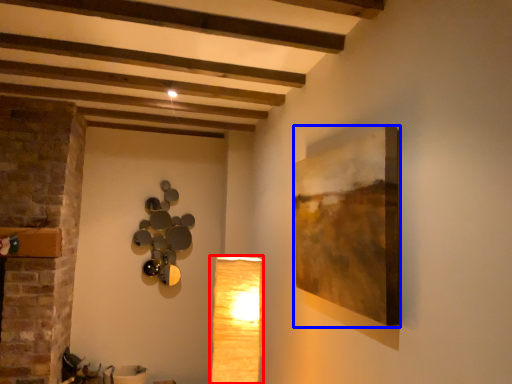
Question: Which object appears closest to the camera in this image, lamp (highlighted by a red box) or picture frame (highlighted by a blue box)?

Choices:
 (A) lamp
 (B) picture frame

Answer: (B)